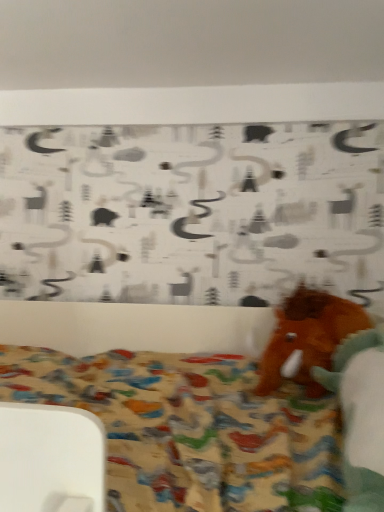
Identify the location of brown plush elephant at right. (308, 337).

Describe the element at coordinates (308, 337) in the screenshot. The width and height of the screenshot is (384, 512). I see `brown plush elephant at right` at that location.

Measure the distance between point (x=339, y=321) and camera.

Point (x=339, y=321) and camera are 1.10 meters apart from each other.

The height and width of the screenshot is (512, 384). I want to click on brown plush elephant at right, so click(308, 337).